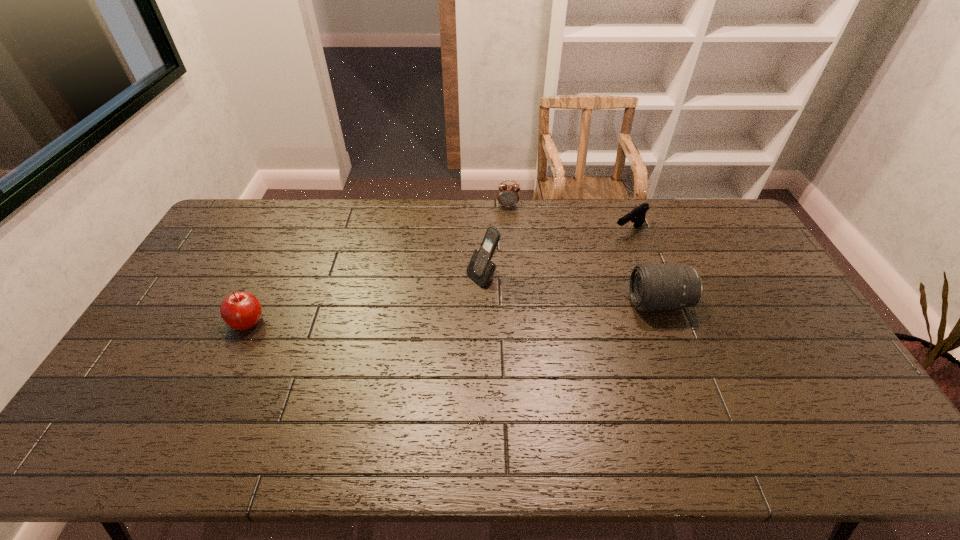
Identify the location of vacant space in between the tallest object and the leftmost object. (366, 299).

Where is `free space between the fourth shortest object and the second object from left to right`? The width and height of the screenshot is (960, 540). free space between the fourth shortest object and the second object from left to right is located at coordinates (571, 290).

Image resolution: width=960 pixels, height=540 pixels. I want to click on empty location between the alarm clock and the shortest object, so click(x=568, y=219).

Where is `vacant area that lies between the telephoto lens and the cellular telephone`? vacant area that lies between the telephoto lens and the cellular telephone is located at coordinates (571, 290).

Image resolution: width=960 pixels, height=540 pixels. Identify the location of vacant space that is in between the apple and the alarm clock. (378, 264).

This screenshot has width=960, height=540. In order to click on unoccupied position between the second farthest object and the leftmost object in this screenshot , I will do `click(439, 276)`.

The height and width of the screenshot is (540, 960). Identify the location of vacant space that is in between the leftmost object and the shortest object. (439, 276).

Identify the location of object that is the second closest to the apple. (508, 195).

I want to click on object that stands as the third closest to the leftmost object, so click(653, 287).

I want to click on free region that satisfies the following two spatial constraints: 1. on the back side of the fourth shortest object; 2. on the surface of the leftmost object, so click(x=257, y=303).